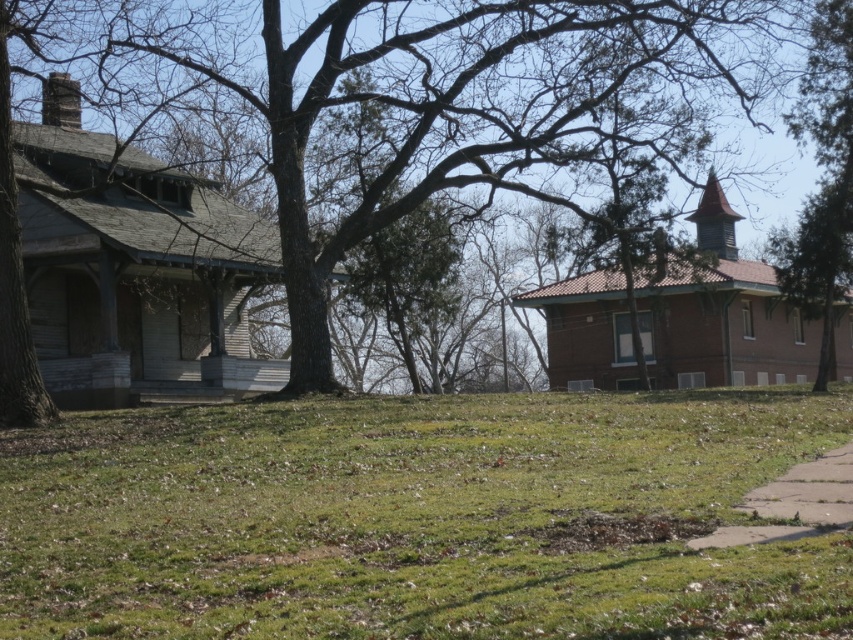
You are a gardener planning to plant flowers along the gray concrete sidewalk at lower right. Considering the position of the green textured tree at right, will the tree overshadow the flowers planted there?

The green textured tree at right is above the gray concrete sidewalk at lower right, so it will overshadow the flowers planted there.